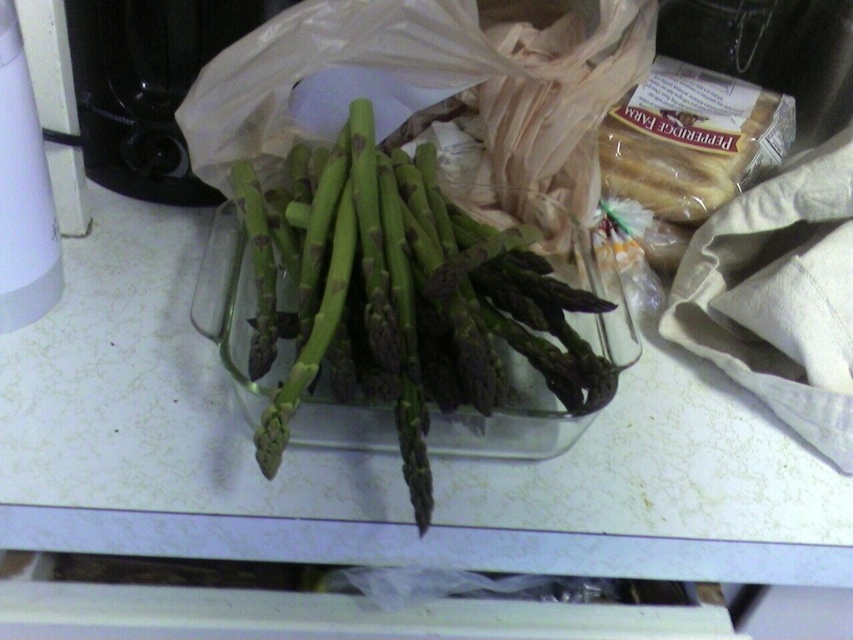
Consider the image. Is green glossy asparagus at center wider than white plastic kettle at left?

Yes, green glossy asparagus at center is wider than white plastic kettle at left.

Is green glossy asparagus at center to the right of white plastic kettle at left from the viewer's perspective?

Correct, you'll find green glossy asparagus at center to the right of white plastic kettle at left.

What do you see at coordinates (401, 298) in the screenshot? The height and width of the screenshot is (640, 853). I see `green glossy asparagus at center` at bounding box center [401, 298].

This screenshot has width=853, height=640. In order to click on green glossy asparagus at center in this screenshot , I will do `click(401, 298)`.

Find the location of a particular element. The height and width of the screenshot is (640, 853). green glossy asparagus at center is located at coordinates (401, 298).

Who is taller, black plastic toaster at upper left or white plastic kettle at left?

white plastic kettle at left

Describe the element at coordinates (148, 86) in the screenshot. I see `black plastic toaster at upper left` at that location.

I want to click on black plastic toaster at upper left, so click(x=148, y=86).